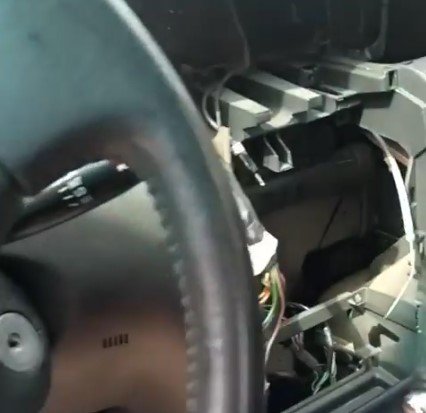
You are a GUI agent. You are given a task and a screenshot of the screen. Output one action in this format:
    pyautogui.click(x=<x>, y=<y>)
    Task: Click on the wires
    
    Given the screenshot: What is the action you would take?
    pyautogui.click(x=266, y=293), pyautogui.click(x=274, y=297), pyautogui.click(x=279, y=294), pyautogui.click(x=402, y=197), pyautogui.click(x=199, y=97), pyautogui.click(x=217, y=99)